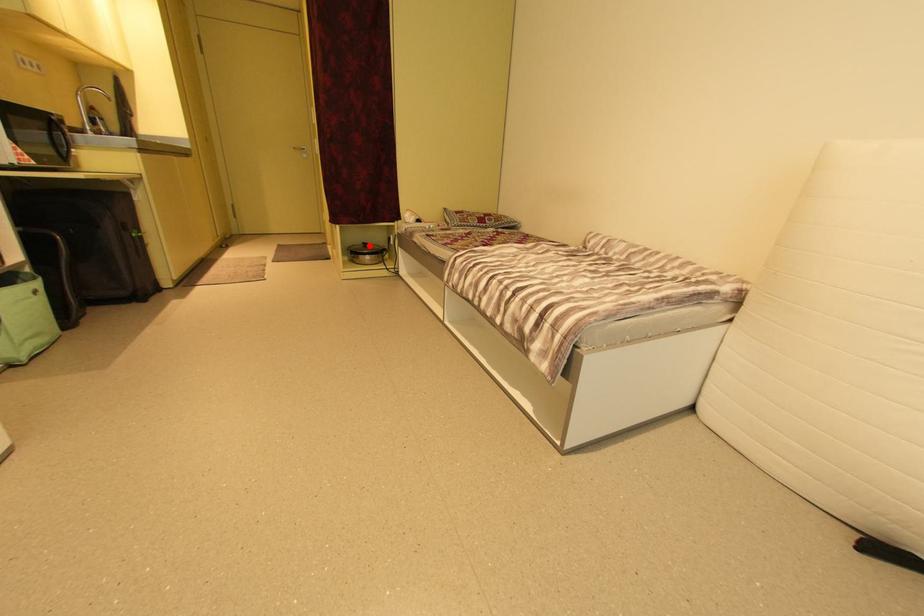
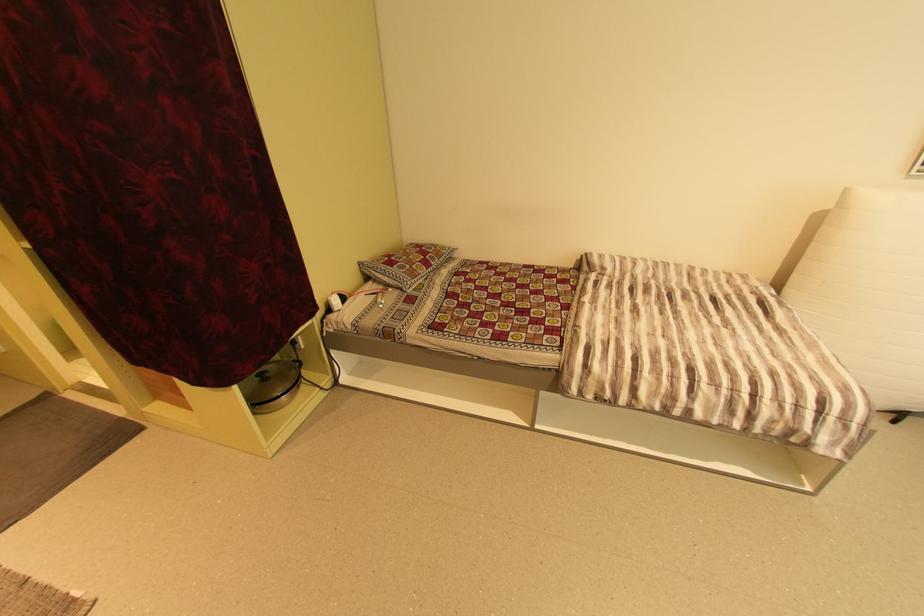
Question: I am providing you with two images of the same scene from different viewpoints. In image1, a red point is highlighted. Considering the same 3D point in image2, which of the following is correct?

Choices:
 (A) It is closer
 (B) It is farther

Answer: (B)